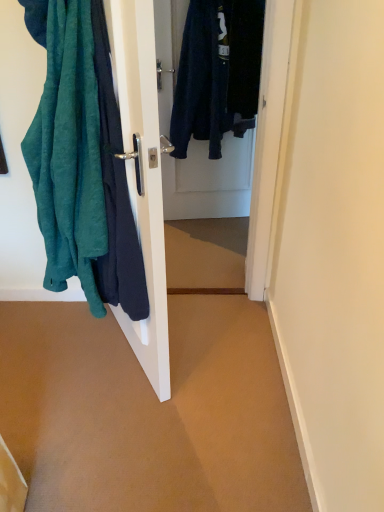
The height and width of the screenshot is (512, 384). I want to click on vacant space underneath teal fabric at left (from a real-world perspective), so click(x=132, y=362).